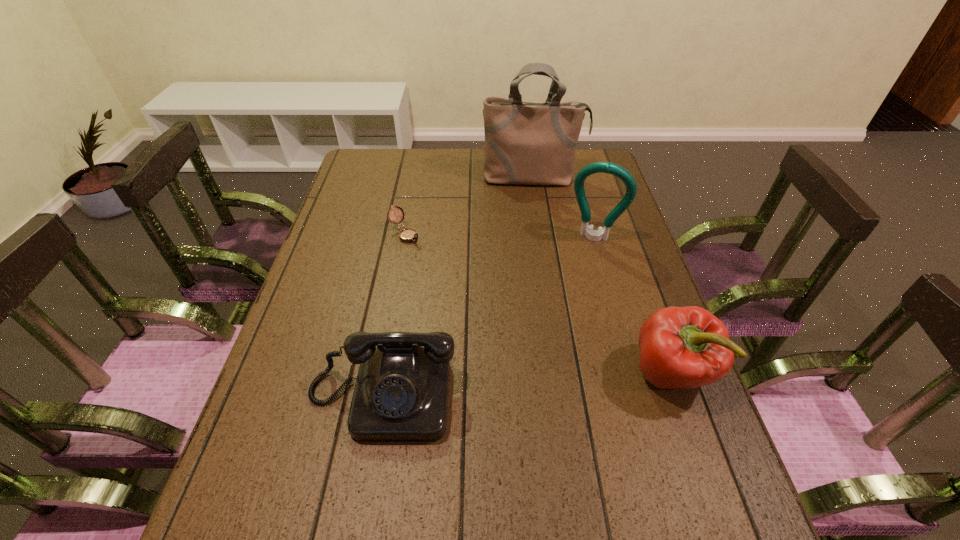
This screenshot has height=540, width=960. In order to click on vacant space on the desktop that is between the fourth tallest object and the third tallest object and is positioned at the jaws of the fourth shortest object in this screenshot , I will do pos(544,383).

Where is `vacant space on the desktop that is between the second shortest object and the bell pepper and is positioned on the front-facing side of the tallest object`? This screenshot has width=960, height=540. vacant space on the desktop that is between the second shortest object and the bell pepper and is positioned on the front-facing side of the tallest object is located at coordinates (558, 382).

What are the coordinates of `vacant space on the desktop that is between the telephone and the bell pepper and is positioned on the face of the compass` in the screenshot? It's located at (565, 382).